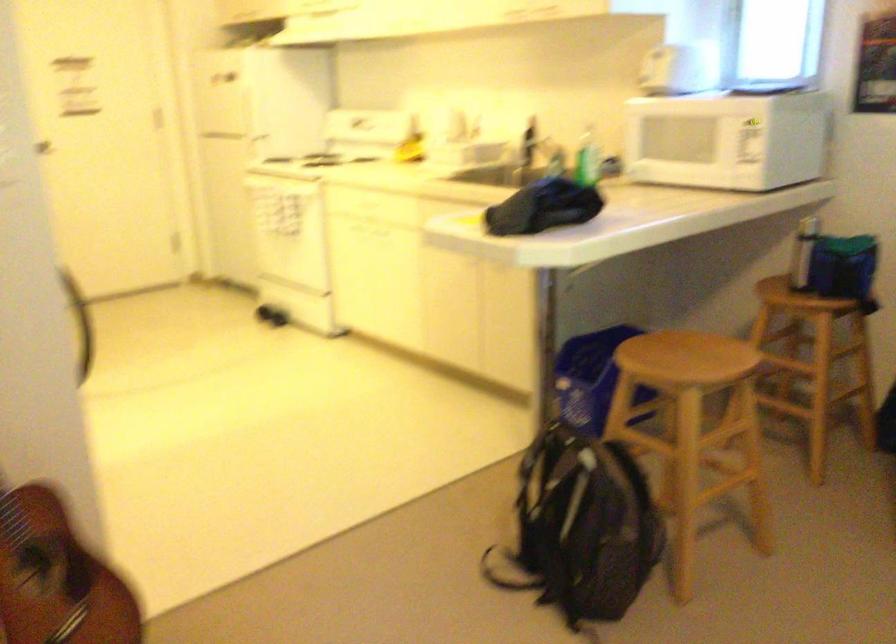
Question: The images are taken continuously from a first-person perspective. In which direction is your viewpoint rotating?

Choices:
 (A) Left
 (B) Right
 (C) Up
 (D) Down

Answer: (A)